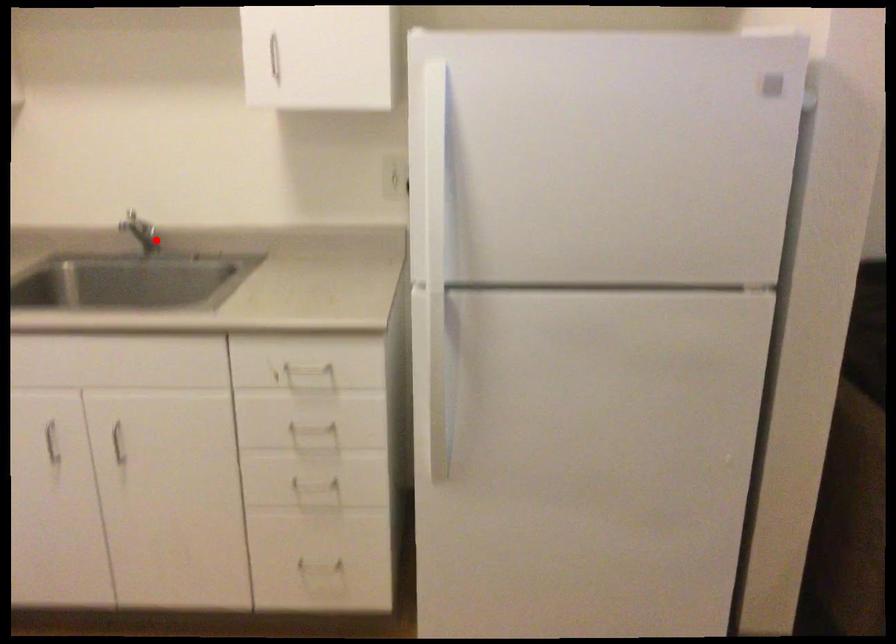
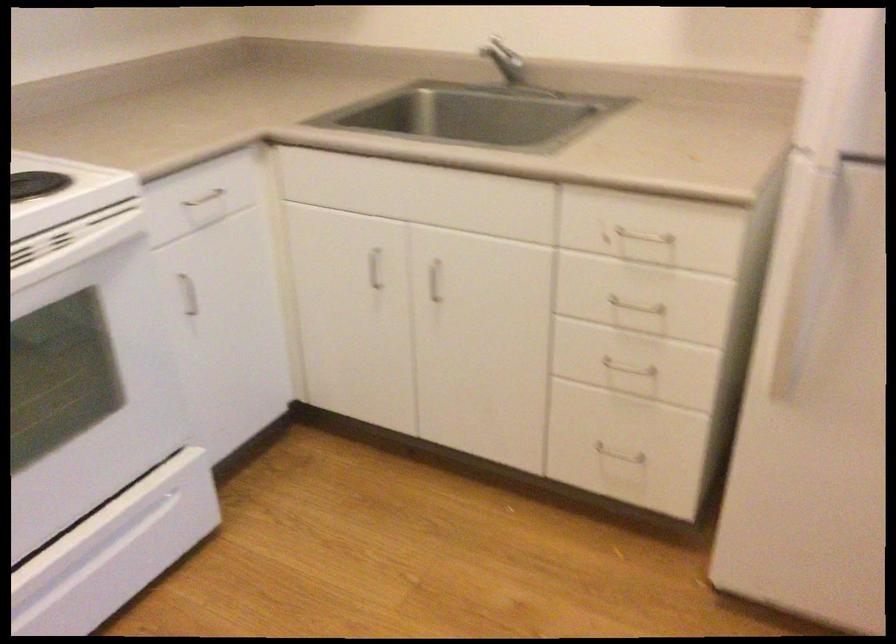
Find the pixel in the second image that matches the highlighted location in the first image.

(510, 68)